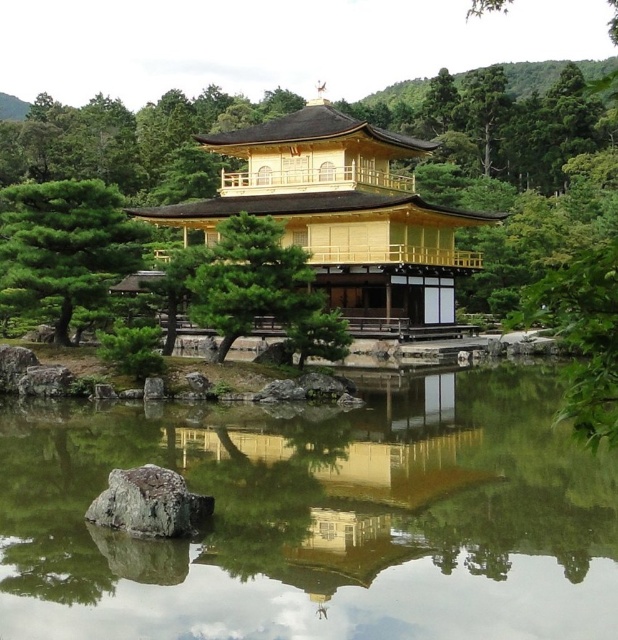
Describe the element at coordinates (341, 214) in the screenshot. The height and width of the screenshot is (640, 618). I see `golden polished wood pagoda at center` at that location.

Can you confirm if golden polished wood pagoda at center is positioned to the left of green textured tree at center?

No, golden polished wood pagoda at center is not to the left of green textured tree at center.

Describe the element at coordinates (341, 214) in the screenshot. Image resolution: width=618 pixels, height=640 pixels. I see `golden polished wood pagoda at center` at that location.

Locate an element on the screen. This screenshot has width=618, height=640. golden polished wood pagoda at center is located at coordinates (341, 214).

Who is positioned more to the right, transparent glass lake at center or gray rough rock at center?

transparent glass lake at center

Between point (522, 596) and point (161, 520), which one is positioned behind?

Positioned behind is point (161, 520).

The height and width of the screenshot is (640, 618). Describe the element at coordinates (318, 516) in the screenshot. I see `transparent glass lake at center` at that location.

Locate an element on the screen. transparent glass lake at center is located at coordinates (318, 516).

Who is lower down, green matte tree at center-left or gray rough rock at center?

gray rough rock at center is below.

Does green matte tree at center-left have a greater width compared to gray rough rock at center?

Yes.

Who is more forward, (57, 202) or (106, 513)?

Point (106, 513) is in front.

Where is `green matte tree at center-left`? green matte tree at center-left is located at coordinates (64, 250).